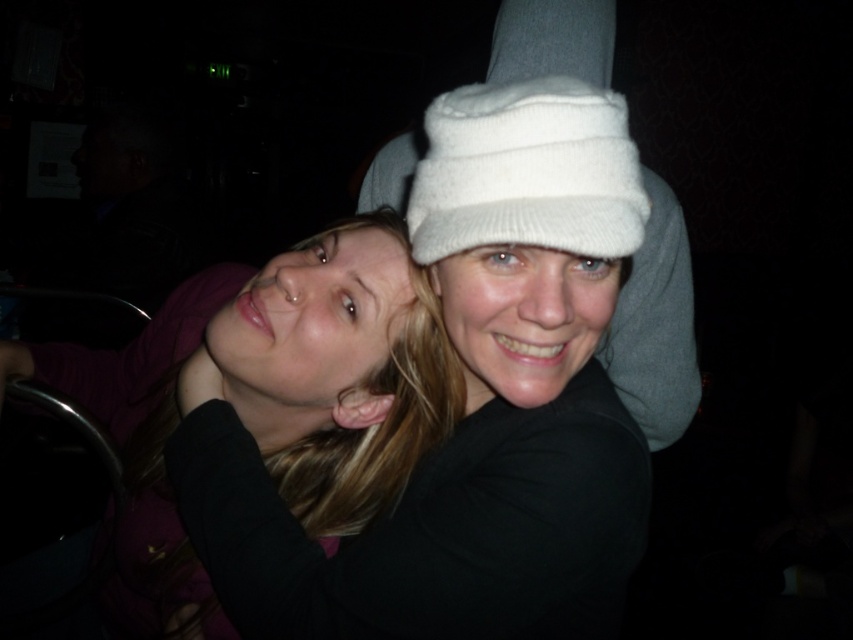
You are a photographer trying to capture a closeup of the matte black hair at center and the white knitted hat at center. Given their sizes, which one should you focus on to ensure both fit within the frame without cropping?

The matte black hair at center is larger in size compared to the white knitted hat at center, so you should focus on the matte black hair at center to ensure both fit within the frame without cropping.

You are standing at the origin point in the image. There are two points marked in the scene, point 1 at coordinates point (532, 131) and point 2 at coordinates point (370, 182). Which point is closer to you?

Point (532, 131) is in front of point (370, 182), so it is closer to you.

You are a photographer trying to adjust the lighting for a portrait. You need to place a spotlight at the same position as the light source above the two individuals. If the matte black hair at center is located at coordinates 0.620, 0.321, what are the coordinates of the light source?

The coordinates of the light source cannot be determined from the given information.